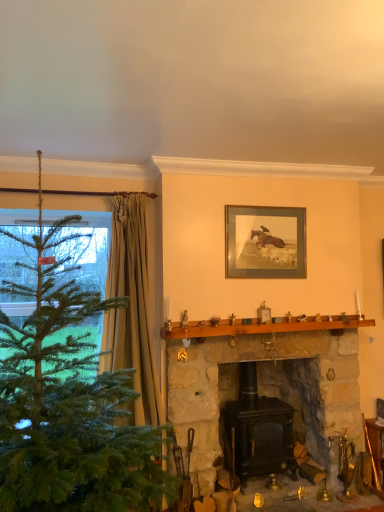
Where is `blank space situated above wooden frame at upper center (from a real-world perspective)`? This screenshot has width=384, height=512. blank space situated above wooden frame at upper center (from a real-world perspective) is located at coordinates (265, 205).